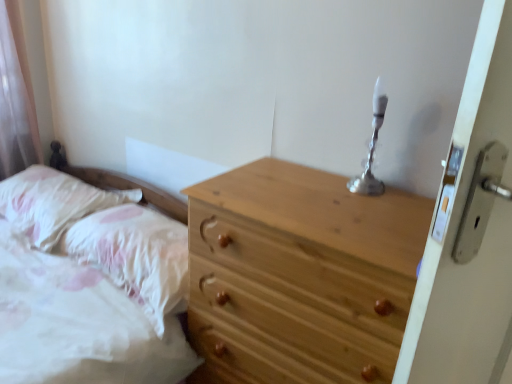
At what (x,y) coordinates should I click in order to perform the action: click on vacant space positioned to the left of silver metallic candle holder at upper right. Please return your answer as a coordinate pair (x, y). The width and height of the screenshot is (512, 384). Looking at the image, I should click on 308,183.